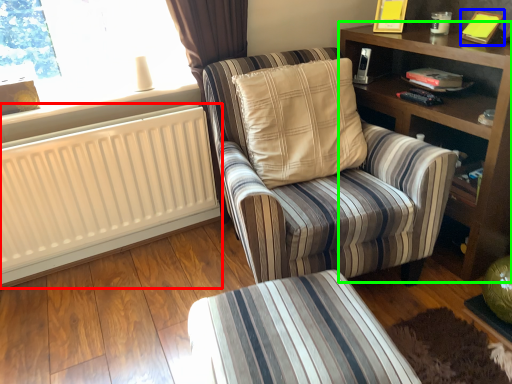
Question: Estimate the real-world distances between objects in this image. Which object is closer to radiator (highlighted by a red box), book (highlighted by a blue box) or shelf (highlighted by a green box)?

Choices:
 (A) book
 (B) shelf

Answer: (B)